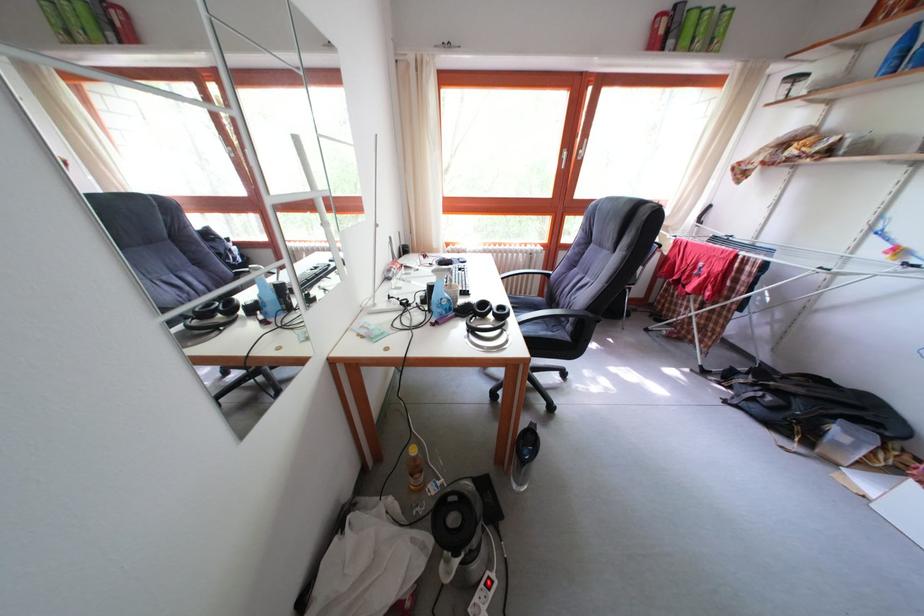
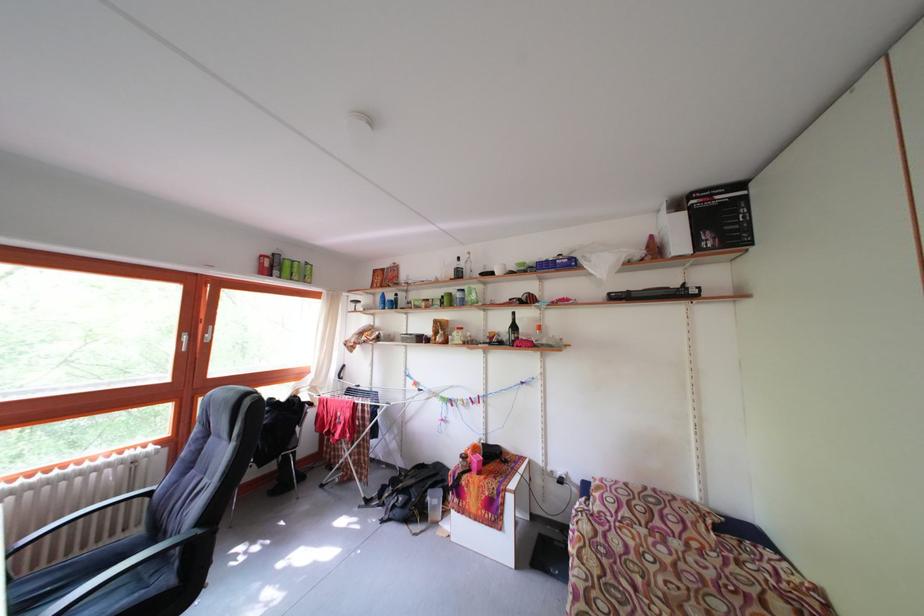
First-person continuous shooting, in which direction is the camera rotating?

The rotation direction of the camera is right-up.